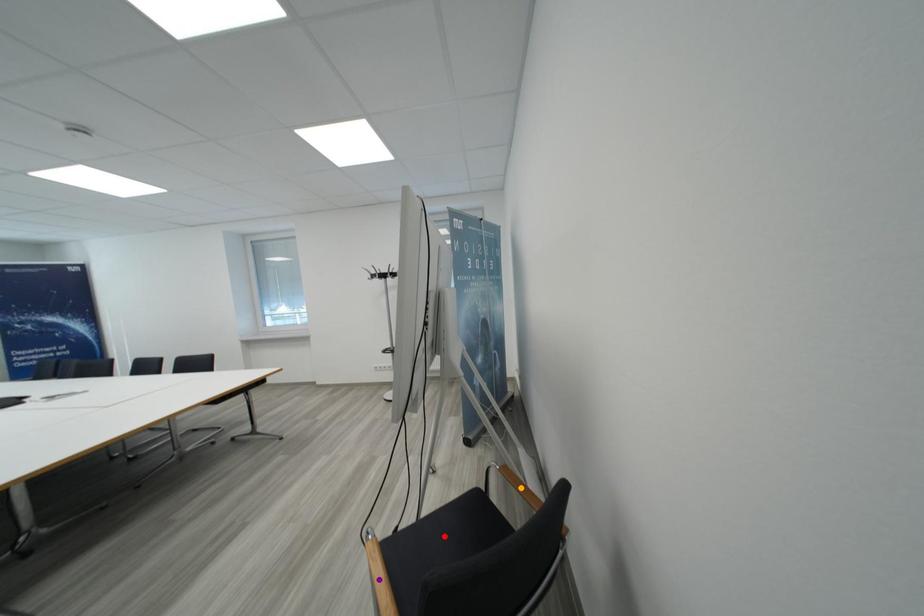
Order these from nearest to farthest:
orange point, purple point, red point

purple point < orange point < red point